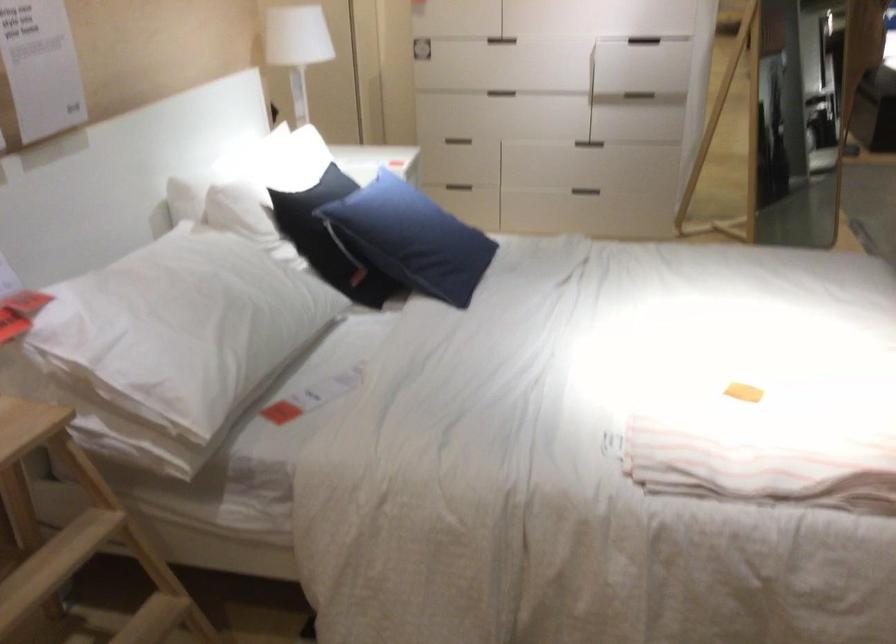
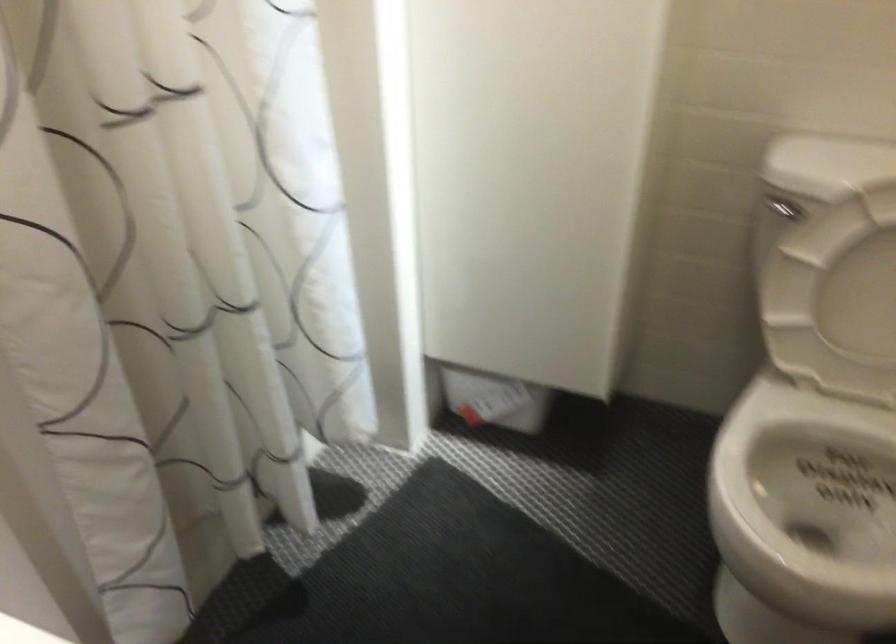
From the picture: What movement of the cameraman would produce the second image?

The cameraman moved toward left, forward.